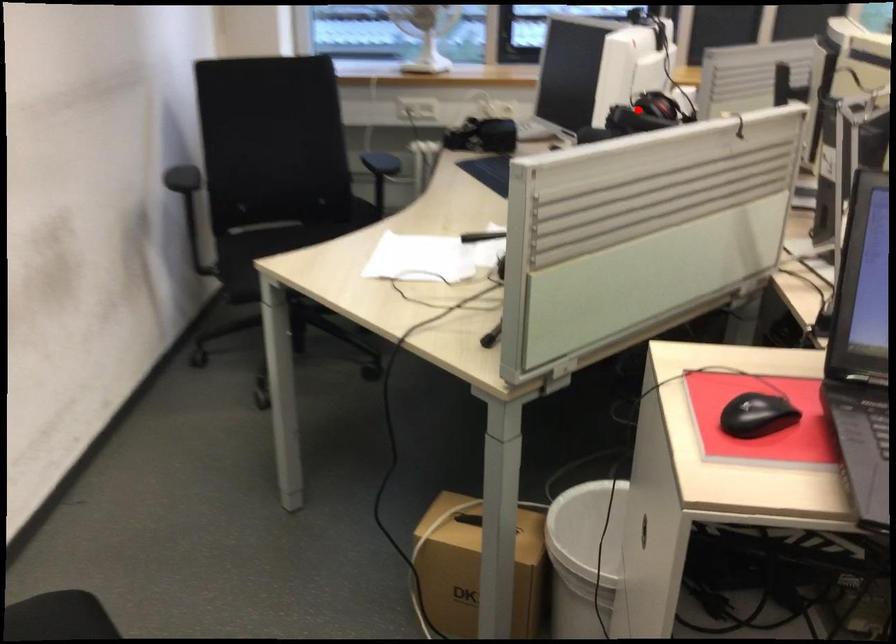
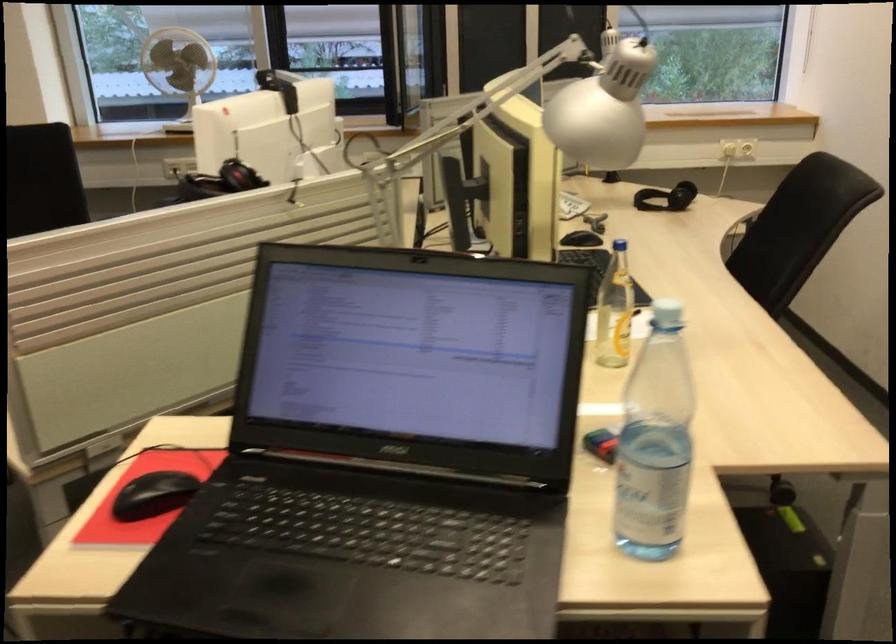
Locate, in the second image, the point that corresponds to the highlighted location in the first image.

(220, 182)